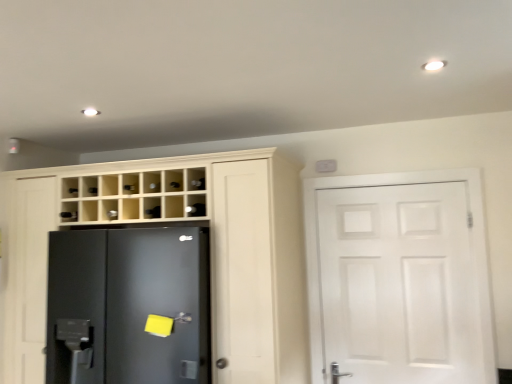
Question: Is satin nickel door handle at lower center facing towards white matte door at right?

Choices:
 (A) no
 (B) yes

Answer: (A)

Question: Is the surface of satin nickel door handle at lower center in direct contact with white matte door at right?

Choices:
 (A) no
 (B) yes

Answer: (A)

Question: Considering the relative positions of satin nickel door handle at lower center and white matte door at right in the image provided, is satin nickel door handle at lower center to the right of white matte door at right from the viewer's perspective?

Choices:
 (A) no
 (B) yes

Answer: (A)

Question: Considering the relative sizes of satin nickel door handle at lower center and white matte door at right in the image provided, is satin nickel door handle at lower center wider than white matte door at right?

Choices:
 (A) yes
 (B) no

Answer: (B)

Question: From a real-world perspective, is satin nickel door handle at lower center over white matte door at right?

Choices:
 (A) yes
 (B) no

Answer: (B)

Question: From the image's perspective, is white matte door at right positioned above or below satin nickel door handle at lower center?

Choices:
 (A) below
 (B) above

Answer: (B)

Question: In the image, is white matte door at right on the left side or the right side of satin nickel door handle at lower center?

Choices:
 (A) right
 (B) left

Answer: (A)

Question: Choose the correct answer: Is white matte door at right inside satin nickel door handle at lower center or outside it?

Choices:
 (A) inside
 (B) outside

Answer: (B)

Question: Considering the positions of white matte door at right and satin nickel door handle at lower center in the image, is white matte door at right bigger or smaller than satin nickel door handle at lower center?

Choices:
 (A) big
 (B) small

Answer: (A)

Question: Visually, is black matte refrigerator at left positioned to the left or to the right of white matte door at right?

Choices:
 (A) left
 (B) right

Answer: (A)

Question: Is black matte refrigerator at left taller or shorter than white matte door at right?

Choices:
 (A) short
 (B) tall

Answer: (A)

Question: Considering the positions of black matte refrigerator at left and white matte door at right in the image, is black matte refrigerator at left wider or thinner than white matte door at right?

Choices:
 (A) thin
 (B) wide

Answer: (B)

Question: Is black matte refrigerator at left in front of or behind white matte door at right in the image?

Choices:
 (A) behind
 (B) front

Answer: (B)

Question: Does point (278, 304) appear closer or farther from the camera than point (181, 314)?

Choices:
 (A) farther
 (B) closer

Answer: (A)

Question: Is matte wood cupboard at center spatially inside satin nickel door handle at lower center, or outside of it?

Choices:
 (A) inside
 (B) outside

Answer: (B)